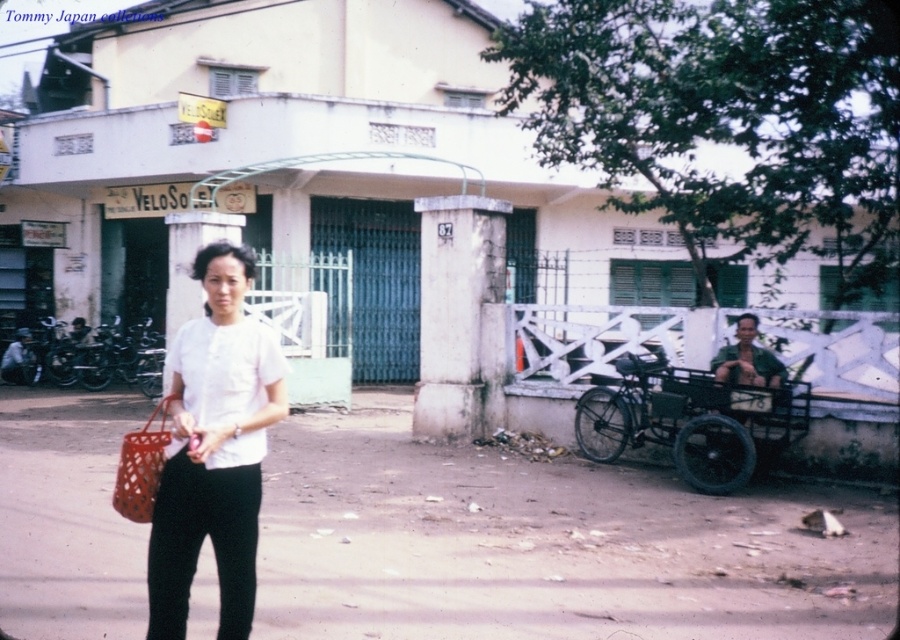
You are a delivery person trying to navigate through the street. There is a white matte shirt at center and a black metal cart at right. Which object should you avoid hitting if you move towards the right side of the street?

The black metal cart at right is on the right side of the street, so you should avoid hitting it when moving towards the right side of the street.

Consider the image. You are a delivery person trying to place a package on the ground. You see the brown dirt pavement at center and the white matte shirt at center. Which object is lower and suitable for placing the package?

The brown dirt pavement at center is below the white matte shirt at center, so it is lower and suitable for placing the package.